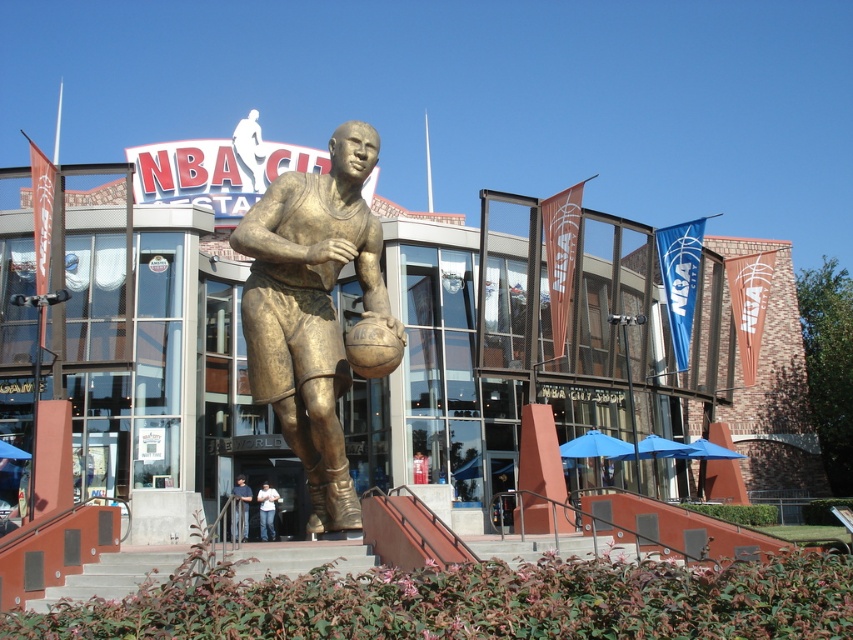
Question: Considering the real-world distances, which object is farthest from the concrete stairs at center?

Choices:
 (A) light blue jeans at center
 (B) gold statue at center
 (C) dark blue jeans at center
 (D) bronze basketball player at center

Answer: (B)

Question: Is gold statue at center thinner than dark blue jeans at center?

Choices:
 (A) yes
 (B) no

Answer: (B)

Question: Considering the real-world distances, which object is closest to the gold statue at center?

Choices:
 (A) bronze basketball player at center
 (B) concrete stairs at center
 (C) light blue jeans at center
 (D) dark blue jeans at center

Answer: (A)

Question: Which of the following is the closest to the observer?

Choices:
 (A) (x=271, y=504)
 (B) (x=265, y=348)
 (C) (x=100, y=269)

Answer: (B)

Question: Does concrete stairs at center appear on the left side of light blue jeans at center?

Choices:
 (A) yes
 (B) no

Answer: (B)

Question: Does gold statue at center have a smaller size compared to dark blue jeans at center?

Choices:
 (A) no
 (B) yes

Answer: (A)